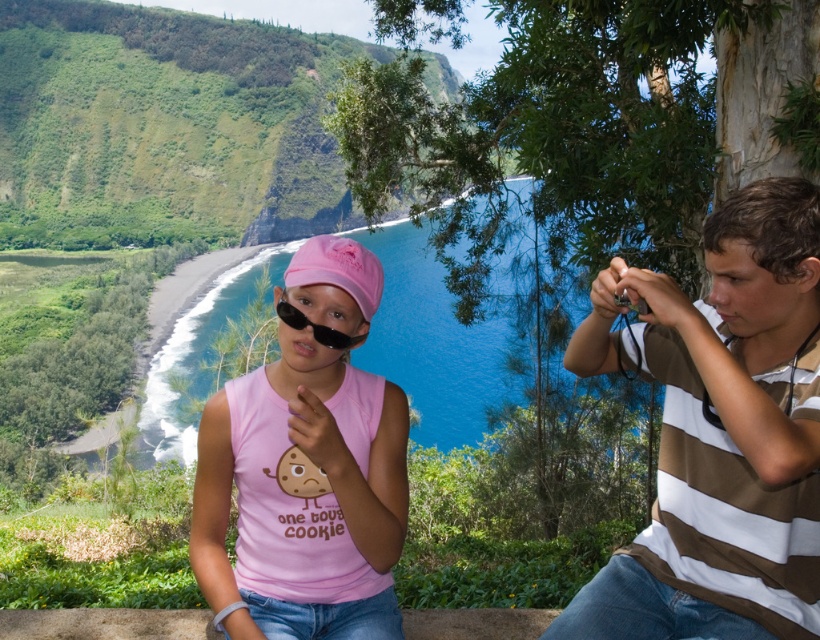
You are a photographer trying to capture the perfect shot of the pink matte tank top at center and the black matte goggles at center. Since you want to ensure both are in focus, you need to know their vertical positions. Which object is positioned lower in the image?

The pink matte tank top at center is located below the black matte goggles at center, so the pink matte tank top at center is positioned lower in the image.